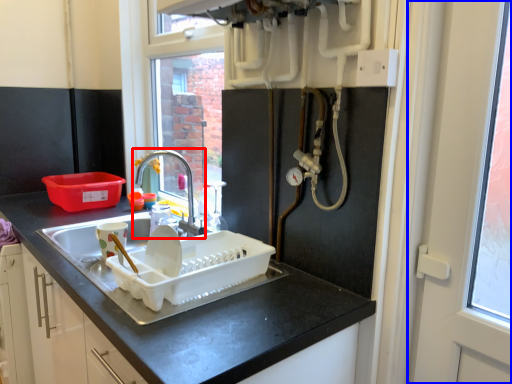
Question: Which of the following is the closest to the observer, tap (highlighted by a red box) or screen door (highlighted by a blue box)?

Choices:
 (A) tap
 (B) screen door

Answer: (B)